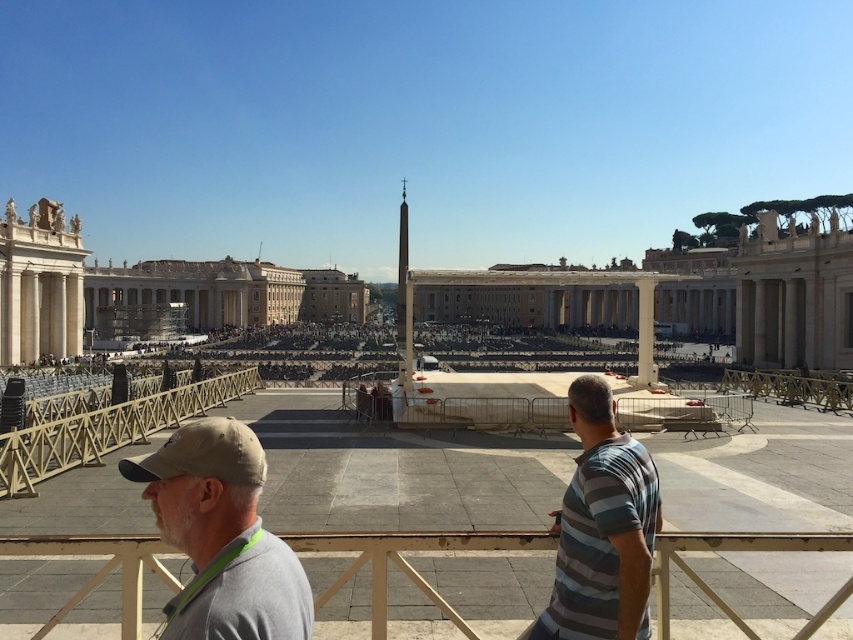
Question: Is wooden at left wider than white marble pillar at center?

Choices:
 (A) yes
 (B) no

Answer: (B)

Question: Which point is closer to the camera taking this photo?

Choices:
 (A) (579, 616)
 (B) (144, 429)

Answer: (A)

Question: Estimate the real-world distances between objects in this image. Which object is farther from the gray fabric cap at lower left?

Choices:
 (A) white marble pillar at center
 (B) striped cotton shirt at center

Answer: (A)

Question: Which of the following is the closest to the observer?

Choices:
 (A) (25, 472)
 (B) (648, 352)
 (C) (780, 550)

Answer: (C)

Question: Where is gray fabric cap at lower left located in relation to striped cotton shirt at center in the image?

Choices:
 (A) above
 (B) below

Answer: (B)

Question: Does gray fabric cap at lower left appear on the left side of wooden at left?

Choices:
 (A) no
 (B) yes

Answer: (A)